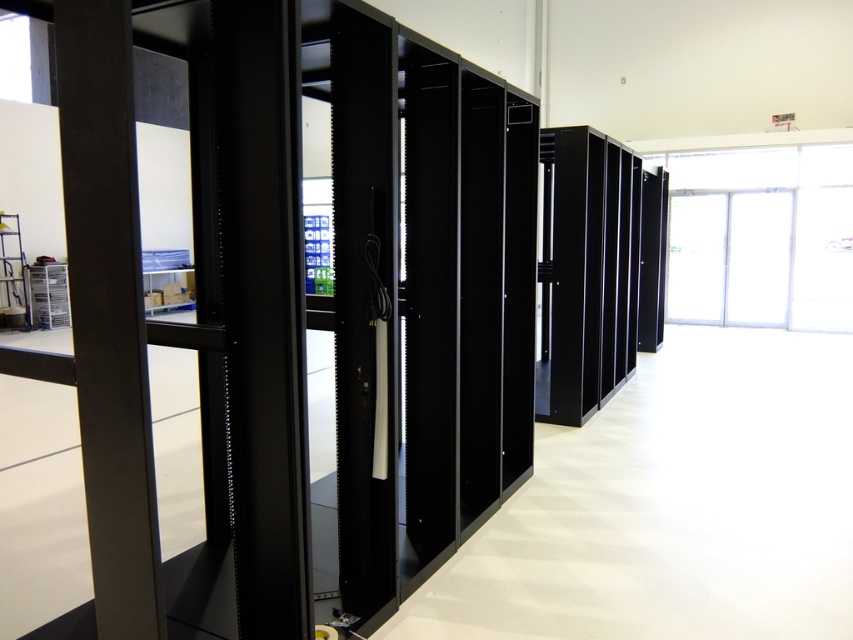
You are a technician entering the server room and need to navigate around the matte black pillar at left and the black matte server rack at center. Which object requires more space to maneuver around?

The black matte server rack at center requires more space to maneuver around because it occupies more space than the matte black pillar at left according to the description.

You are a technician needing to access the black matte server rack at center. There is a matte black pillar at left in your path. From your current position, which direction should you move to reach the server rack while avoiding the pillar?

Since the matte black pillar at left is to the left of the black matte server rack at center, you should move to the right to navigate around the pillar and reach the server rack.

You are navigating a server room and need to locate the matte black pillar at left. According to the coordinates provided, where would you find it in the image?

The matte black pillar at left is located at coordinates point [108,312].